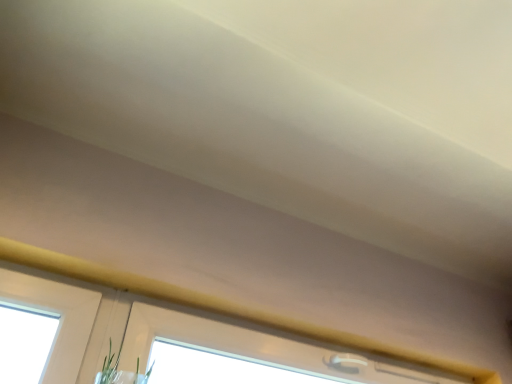
What do you see at coordinates (185, 332) in the screenshot? This screenshot has width=512, height=384. I see `white plastic window at upper center` at bounding box center [185, 332].

Locate an element on the screen. This screenshot has height=384, width=512. white plastic window at upper center is located at coordinates (185, 332).

The image size is (512, 384). What do you see at coordinates (120, 371) in the screenshot?
I see `green matte plant at lower center` at bounding box center [120, 371].

Find the location of a particular element. green matte plant at lower center is located at coordinates (120, 371).

You are a GUI agent. You are given a task and a screenshot of the screen. Output one action in this format:
    pyautogui.click(x=<x>, y=<y>)
    Task: Click on the white plastic window at upper center
    The height and width of the screenshot is (384, 512).
    Given the screenshot: What is the action you would take?
    pyautogui.click(x=185, y=332)

Which object is positioned more to the left, green matte plant at lower center or white plastic window at upper center?

green matte plant at lower center.

Considering their positions, is green matte plant at lower center located in front of or behind white plastic window at upper center?

Clearly, green matte plant at lower center is in front of white plastic window at upper center.

Does point (110, 349) appear closer or farther from the camera than point (222, 327)?

Point (110, 349) appears to be closer to the viewer than point (222, 327).

From the image's perspective, would you say green matte plant at lower center is shown under white plastic window at upper center?

Yes, from the image's perspective, green matte plant at lower center is below white plastic window at upper center.

Based on the photo, from a real-world perspective, is green matte plant at lower center positioned under white plastic window at upper center based on gravity?

Yes.

Is green matte plant at lower center wider than white plastic window at upper center?

No.

Does green matte plant at lower center have a greater height compared to white plastic window at upper center?

Yes, green matte plant at lower center is taller than white plastic window at upper center.

Which of these two, green matte plant at lower center or white plastic window at upper center, is smaller?

white plastic window at upper center is smaller.

Is green matte plant at lower center inside or outside of white plastic window at upper center?

green matte plant at lower center is not enclosed by white plastic window at upper center.

Does green matte plant at lower center touch white plastic window at upper center?

No, green matte plant at lower center is not with white plastic window at upper center.

Is green matte plant at lower center looking in the opposite direction of white plastic window at upper center?

No.

Can you tell me how much green matte plant at lower center and white plastic window at upper center differ in facing direction?

They differ by 0.41 degrees in their facing directions.

The image size is (512, 384). I want to click on plant on the left of white plastic window at upper center, so click(x=120, y=371).

Considering the relative positions of white plastic window at upper center and green matte plant at lower center in the image provided, is white plastic window at upper center to the left or to the right of green matte plant at lower center?

Clearly, white plastic window at upper center is on the right of green matte plant at lower center in the image.

Who is more distant, white plastic window at upper center or green matte plant at lower center?

white plastic window at upper center is behind.

Is point (168, 302) positioned before point (122, 372)?

No, it is not.

From the image's perspective, which one is positioned lower, white plastic window at upper center or green matte plant at lower center?

From the image's view, green matte plant at lower center is below.

From a real-world perspective, is white plastic window at upper center over green matte plant at lower center?

Indeed, from a real-world perspective, white plastic window at upper center stands above green matte plant at lower center.

Between white plastic window at upper center and green matte plant at lower center, which one has larger width?

white plastic window at upper center is wider.

Looking at this image, considering the relative sizes of white plastic window at upper center and green matte plant at lower center in the image provided, is white plastic window at upper center shorter than green matte plant at lower center?

Yes, white plastic window at upper center is shorter than green matte plant at lower center.

Considering the sizes of objects white plastic window at upper center and green matte plant at lower center in the image provided, who is bigger, white plastic window at upper center or green matte plant at lower center?

Bigger between the two is green matte plant at lower center.

Would you say white plastic window at upper center is outside green matte plant at lower center?

Answer: Absolutely, white plastic window at upper center is external to green matte plant at lower center.

Are white plastic window at upper center and green matte plant at lower center far apart?

No, white plastic window at upper center is not far away from green matte plant at lower center.

Is white plastic window at upper center positioned with its back to green matte plant at lower center?

That's not correct — white plastic window at upper center is not looking away from green matte plant at lower center.

From the picture: Can you tell me how much white plastic window at upper center and green matte plant at lower center differ in facing direction?

There is a 0.41-degree angle between the facing directions of white plastic window at upper center and green matte plant at lower center.

Measure the distance between white plastic window at upper center and green matte plant at lower center.

white plastic window at upper center is 9.12 inches from green matte plant at lower center.

Identify the location of window to the right of green matte plant at lower center. The width and height of the screenshot is (512, 384). (185, 332).

You are a GUI agent. You are given a task and a screenshot of the screen. Output one action in this format:
    pyautogui.click(x=<x>, y=<y>)
    Task: Click on the window above the green matte plant at lower center (from a real-world perspective)
    
    Given the screenshot: What is the action you would take?
    pyautogui.click(x=185, y=332)

The image size is (512, 384). Find the location of `window behind the green matte plant at lower center`. window behind the green matte plant at lower center is located at coordinates (185, 332).